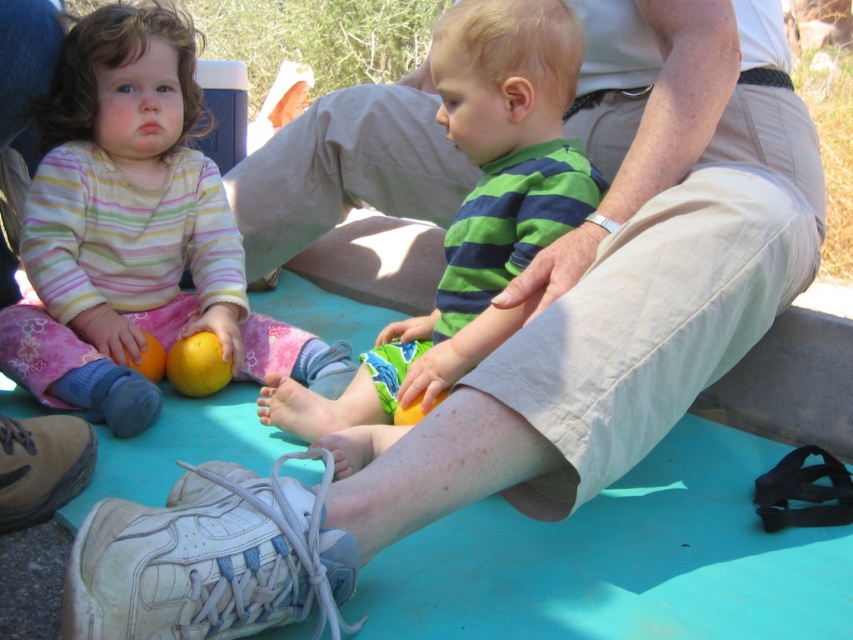
You are standing at the center of the image and want to place a small gift exactly at the point marked by the coordinates. What object is located at the coordinates point (134, 230)?

The coordinates point (134, 230) indicate the location of the matte yellow citrus fruit at lower left.

You are a photographer trying to capture a closeup of the matte yellow citrus fruit at lower left and the orange matte at lower left. Since you can only focus on one object at a time, which one should you position your camera closer to if you want both to be in focus?

You should position your camera closer to the orange matte at lower left because the matte yellow citrus fruit at lower left is to the left of orange matte at lower left, so moving closer to the farther object would help both be in focus.